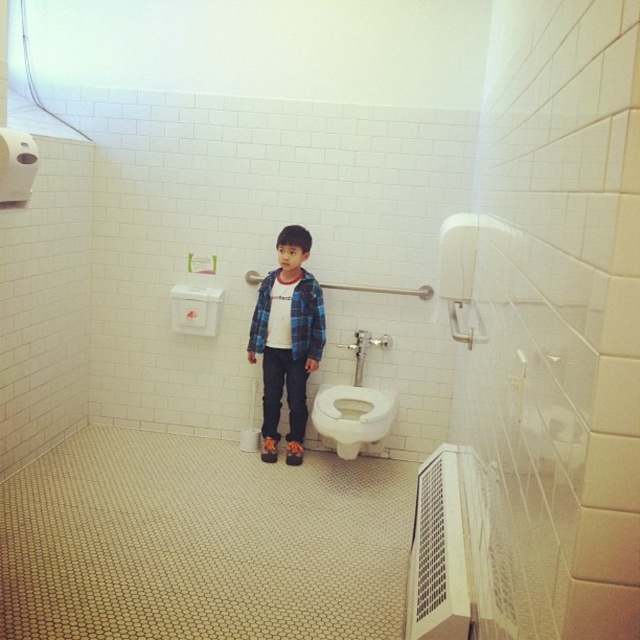
Looking at this image, between white glossy toilet at lower center and white matte toilet paper at upper left, which one has more height?

white glossy toilet at lower center

From the picture: Is the position of white glossy toilet at lower center less distant than that of white matte toilet paper at upper left?

No, white glossy toilet at lower center is further to the viewer.

Does point (340, 451) come in front of point (13, 161)?

No, (340, 451) is behind (13, 161).

Where is `white glossy toilet at lower center`? The image size is (640, 640). white glossy toilet at lower center is located at coordinates (352, 417).

Does matte plaid shirt at center appear on the right side of white glossy toilet at lower center?

Incorrect, matte plaid shirt at center is not on the right side of white glossy toilet at lower center.

Between matte plaid shirt at center and white glossy toilet at lower center, which one appears on the right side from the viewer's perspective?

white glossy toilet at lower center

Does point (301, 400) come farther from viewer compared to point (339, 387)?

Yes, point (301, 400) is farther from viewer.

At what (x,y) coordinates should I click in order to perform the action: click on matte plaid shirt at center. Please return your answer as a coordinate pair (x, y). The height and width of the screenshot is (640, 640). Looking at the image, I should click on (285, 340).

Is matte plaid shirt at center wider than white matte toilet paper at upper left?

Indeed, matte plaid shirt at center has a greater width compared to white matte toilet paper at upper left.

Describe the element at coordinates (285, 340) in the screenshot. I see `matte plaid shirt at center` at that location.

Does point (288, 316) come closer to viewer compared to point (20, 186)?

That is False.

Find the location of a particular element. matte plaid shirt at center is located at coordinates (285, 340).